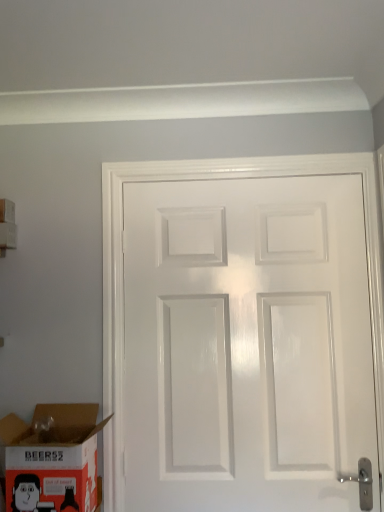
Question: From a real-world perspective, is cardboard box at lower left, the 1th box when ordered from bottom to top, physically above white cardboard box at upper left, positioned as the first box in left-to-right order?

Choices:
 (A) yes
 (B) no

Answer: (B)

Question: Does cardboard box at lower left, positioned as the 2th box in left-to-right order, have a lesser width compared to white cardboard box at upper left, which is the second box in front-to-back order?

Choices:
 (A) no
 (B) yes

Answer: (A)

Question: Can you confirm if cardboard box at lower left, marked as the second box in a back-to-front arrangement, is smaller than white cardboard box at upper left, the second box in the right-to-left sequence?

Choices:
 (A) yes
 (B) no

Answer: (B)

Question: From the image's perspective, is cardboard box at lower left, which is the second box in top-to-bottom order, on white cardboard box at upper left, positioned as the first box in left-to-right order?

Choices:
 (A) no
 (B) yes

Answer: (A)

Question: Is cardboard box at lower left, positioned as the 2th box in left-to-right order, wider than white cardboard box at upper left, which is the 1th box in back-to-front order?

Choices:
 (A) no
 (B) yes

Answer: (B)

Question: Is cardboard box at lower left, marked as the 1th box in a right-to-left arrangement, at the left side of white cardboard box at upper left, marked as the first box in a top-to-bottom arrangement?

Choices:
 (A) no
 (B) yes

Answer: (A)

Question: Is white cardboard box at upper left, which is the 1th box in back-to-front order, aimed at cardboard box at lower left, which is the 1th box from front to back?

Choices:
 (A) yes
 (B) no

Answer: (B)

Question: Would you say cardboard box at lower left, which is the 1th box from front to back, is part of white cardboard box at upper left, the second box in the right-to-left sequence,'s contents?

Choices:
 (A) no
 (B) yes

Answer: (A)

Question: Considering the relative sizes of white cardboard box at upper left, which is the 1th box in back-to-front order, and cardboard box at lower left, marked as the 1th box in a right-to-left arrangement, in the image provided, is white cardboard box at upper left, which is the 1th box in back-to-front order, smaller than cardboard box at lower left, marked as the 1th box in a right-to-left arrangement,?

Choices:
 (A) no
 (B) yes

Answer: (B)

Question: Is white cardboard box at upper left, which is the second box in front-to-back order, in contact with cardboard box at lower left, which is the 1th box from front to back?

Choices:
 (A) no
 (B) yes

Answer: (A)

Question: Is white cardboard box at upper left, the second box in the right-to-left sequence, bigger than cardboard box at lower left, which is the 1th box from front to back?

Choices:
 (A) yes
 (B) no

Answer: (B)

Question: Is white cardboard box at upper left, which is the second box in front-to-back order, thinner than cardboard box at lower left, which is the 1th box from front to back?

Choices:
 (A) yes
 (B) no

Answer: (A)

Question: Is there a large distance between white cardboard box at upper left, which is the second box in front-to-back order, and white glossy door at center?

Choices:
 (A) yes
 (B) no

Answer: (B)